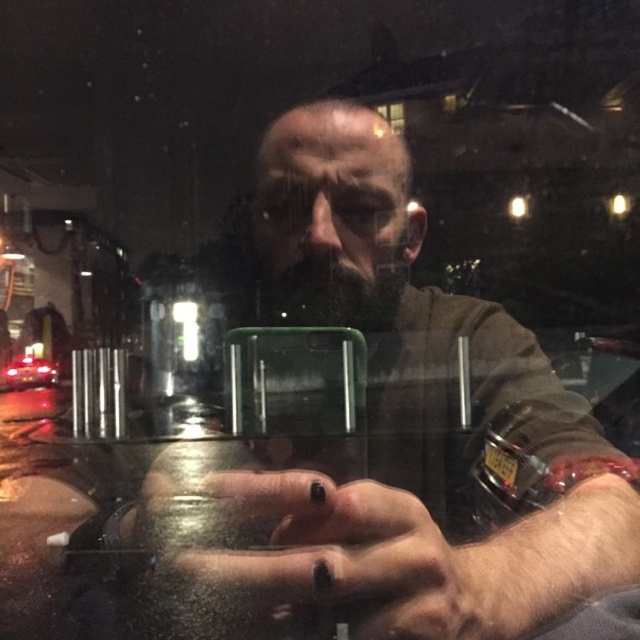
Question: Does matte black wristwatch at center appear on the left side of clear glass window at upper center?

Choices:
 (A) yes
 (B) no

Answer: (A)

Question: Which point is farther to the camera?

Choices:
 (A) (45, 362)
 (B) (556, 515)
 (C) (381, 112)

Answer: (A)

Question: Which point is closer to the camera?

Choices:
 (A) click(36, 362)
 (B) click(397, 419)
 (C) click(221, 563)

Answer: (C)

Question: From the image, what is the correct spatial relationship of matte black wristwatch at center in relation to black matte nails at center?

Choices:
 (A) below
 (B) above

Answer: (B)

Question: Which of the following is the closest to the observer?

Choices:
 (A) clear glass window at upper center
 (B) black matte nails at center
 (C) shiny red car at center
 (D) matte black wristwatch at center

Answer: (D)

Question: Where is black matte nails at center located in relation to clear glass window at upper center in the image?

Choices:
 (A) right
 (B) left

Answer: (B)